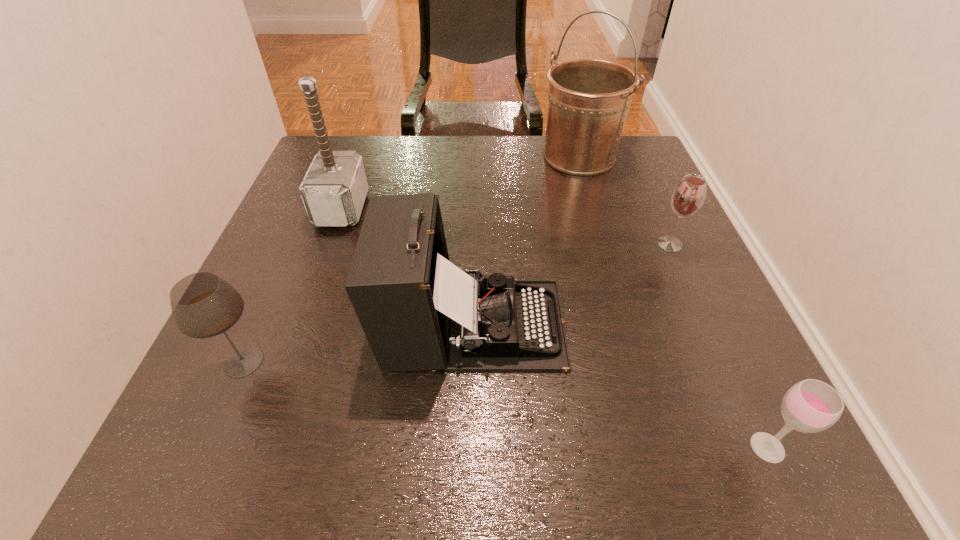
The height and width of the screenshot is (540, 960). I want to click on object present at the far right corner, so click(x=588, y=99).

You are a GUI agent. You are given a task and a screenshot of the screen. Output one action in this format:
    pyautogui.click(x=<x>, y=<y>)
    Task: Click on the object located in the near right corner section of the desktop
    
    Given the screenshot: What is the action you would take?
    pyautogui.click(x=810, y=406)

Identify the location of vacant space at the far edge. (504, 152).

Locate an element on the screen. The width and height of the screenshot is (960, 540). free point at the near edge is located at coordinates (273, 479).

In the image, there is a desktop. Identify the location of vacant space at the left edge. [334, 250].

Find the location of `free spot at the right edge of the desktop`. free spot at the right edge of the desktop is located at coordinates (654, 199).

At what (x,y) coordinates should I click in order to perform the action: click on free space at the near left corner. Please return your answer as a coordinate pair (x, y). This screenshot has width=960, height=540. Looking at the image, I should click on (201, 429).

The image size is (960, 540). Identify the location of vacant space at the far right corner. (625, 163).

This screenshot has height=540, width=960. I want to click on unoccupied position between the leftmost wineglass and the fourth shortest object, so click(358, 342).

Find the location of a particular element. The image size is (960, 540). free spot between the nearest wineglass and the farthest wineglass is located at coordinates (719, 346).